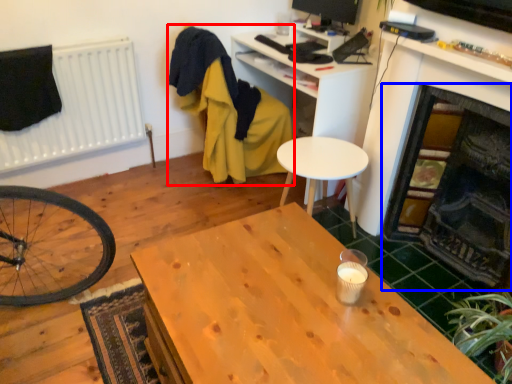
Question: Which point is further to the camera, swivel chair (highlighted by a red box) or fireplace (highlighted by a blue box)?

Choices:
 (A) swivel chair
 (B) fireplace

Answer: (A)